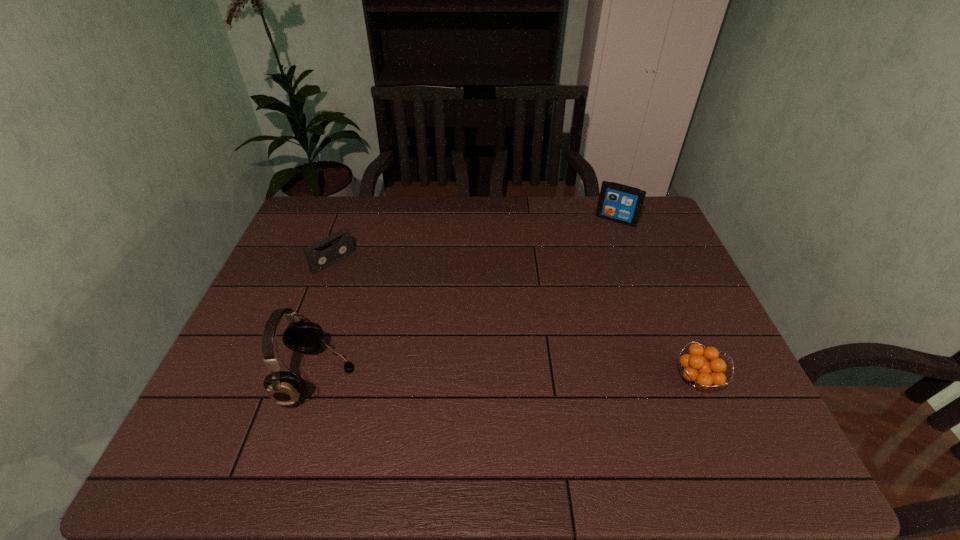
Where is `free spot between the headset and the third shortest object`? The width and height of the screenshot is (960, 540). free spot between the headset and the third shortest object is located at coordinates (467, 298).

Find the location of a particular element. This screenshot has width=960, height=540. vacant area between the videotape and the orange fruit is located at coordinates (516, 321).

At what (x,y) coordinates should I click in order to perform the action: click on free space that is in between the farthest object and the orange fruit. Please return your answer as a coordinate pair (x, y). Looking at the image, I should click on (657, 300).

You are a GUI agent. You are given a task and a screenshot of the screen. Output one action in this format:
    pyautogui.click(x=<x>, y=<y>)
    Task: Click on the free spot between the second tallest object and the tallest object
    The width and height of the screenshot is (960, 540).
    Given the screenshot: What is the action you would take?
    pyautogui.click(x=467, y=298)

At what (x,y) coordinates should I click in order to perform the action: click on vacant space in between the iPod and the orange fruit. Please return your answer as a coordinate pair (x, y). The width and height of the screenshot is (960, 540). Looking at the image, I should click on (657, 300).

Locate an element on the screen. Image resolution: width=960 pixels, height=540 pixels. vacant region between the headset and the orange fruit is located at coordinates tap(508, 379).

Where is `object that stands as the third closest to the second farthest object`? Image resolution: width=960 pixels, height=540 pixels. object that stands as the third closest to the second farthest object is located at coordinates (701, 374).

Locate which object is the second closest to the second farthest object. Please provide its 2D coordinates. Your answer should be formatted as a tuple, i.e. [(x, y)], where the tuple contains the x and y coordinates of a point satisfying the conditions above.

[(617, 202)]

At what (x,y) coordinates should I click in order to perform the action: click on free space that satisfies the following two spatial constraints: 1. on the front side of the second farthest object; 2. with the microphone on the side of the tallest object. Please return your answer as a coordinate pair (x, y). The width and height of the screenshot is (960, 540). Looking at the image, I should click on (291, 377).

Image resolution: width=960 pixels, height=540 pixels. What are the coordinates of `free region that satisfies the following two spatial constraints: 1. on the front side of the videotape; 2. with the microphone on the side of the tallest object` in the screenshot? It's located at (291, 377).